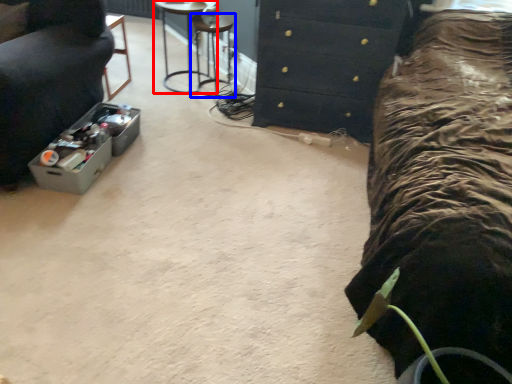
Question: Among these objects, which one is farthest to the camera, furniture (highlighted by a red box) or bar stool (highlighted by a blue box)?

Choices:
 (A) furniture
 (B) bar stool

Answer: (B)